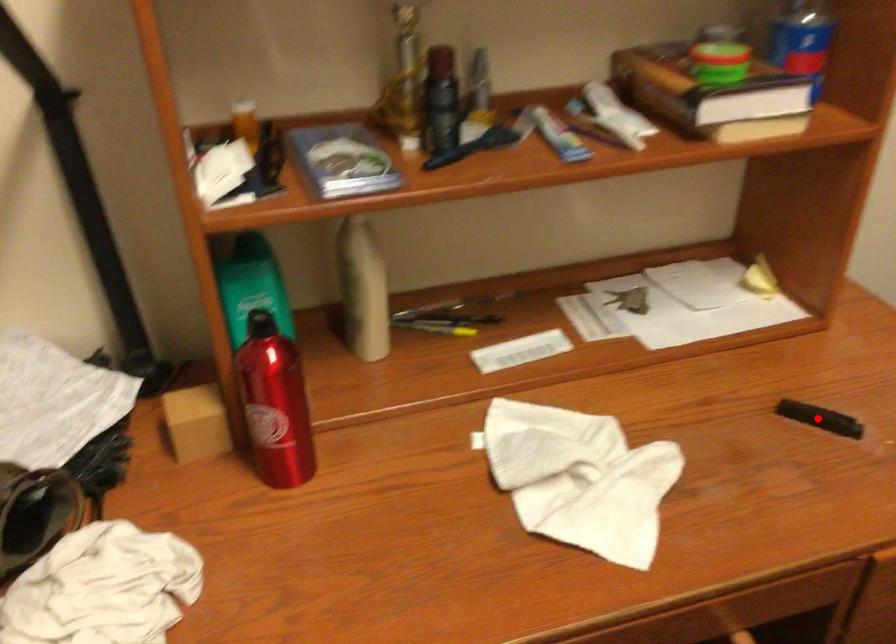
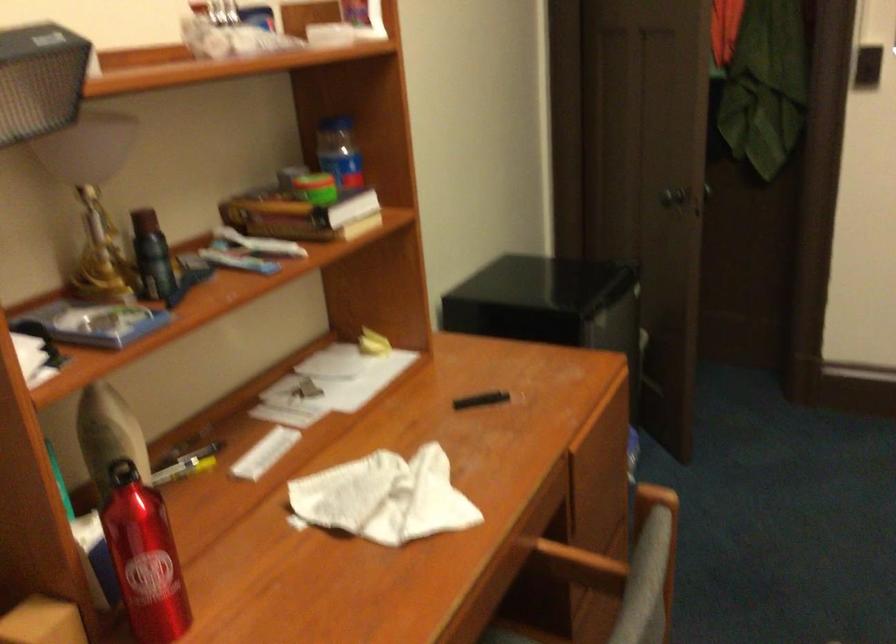
Question: I am providing you with two images of the same scene from different viewpoints. In image1, a red point is highlighted. Considering the same 3D point in image2, which of the following is correct?

Choices:
 (A) It is closer
 (B) It is farther

Answer: (B)